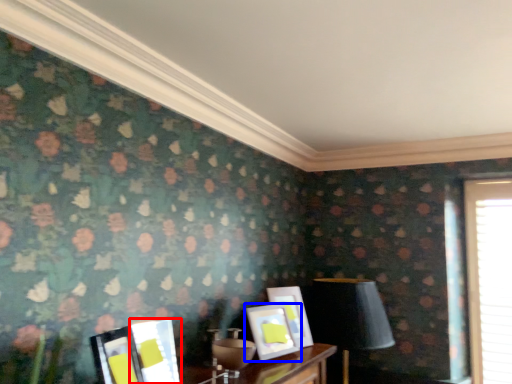
Question: Which point is closer to the camera, picture frame (highlighted by a red box) or picture frame (highlighted by a blue box)?

Choices:
 (A) picture frame
 (B) picture frame

Answer: (A)